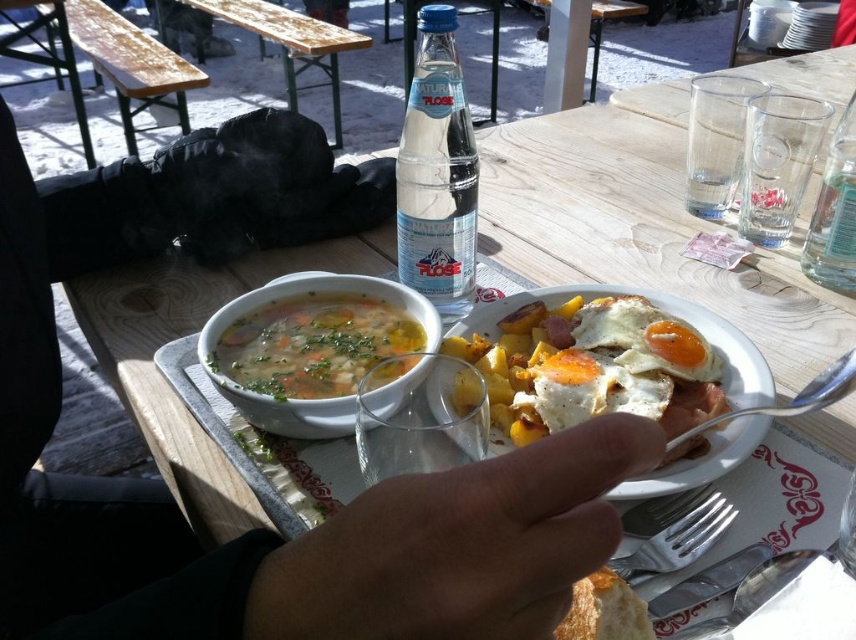
You are a food critic observing the silver metallic fork at lower center and the golden crispy bread at lower center on the table. Which item is positioned more to the right side?

The silver metallic fork at lower center is positioned to the right of the golden crispy bread at lower center.

You are a food critic trying to taste the golden crispy bread at lower center while holding the silver metallic fork at lower center. Can you reach the bread without moving your hand?

The silver metallic fork at lower center and golden crispy bread at lower center are 2.22 inches apart, so yes, you can reach the golden crispy bread at lower center while holding the silver metallic fork at lower center without moving your hand.

You are a photographer trying to capture both the clear glass bottle at center and the silver metallic fork at lower center in your shot. Which object will appear larger in the photo?

The clear glass bottle at center will appear larger in the photo because it is closer to the viewer than the silver metallic fork at lower center.